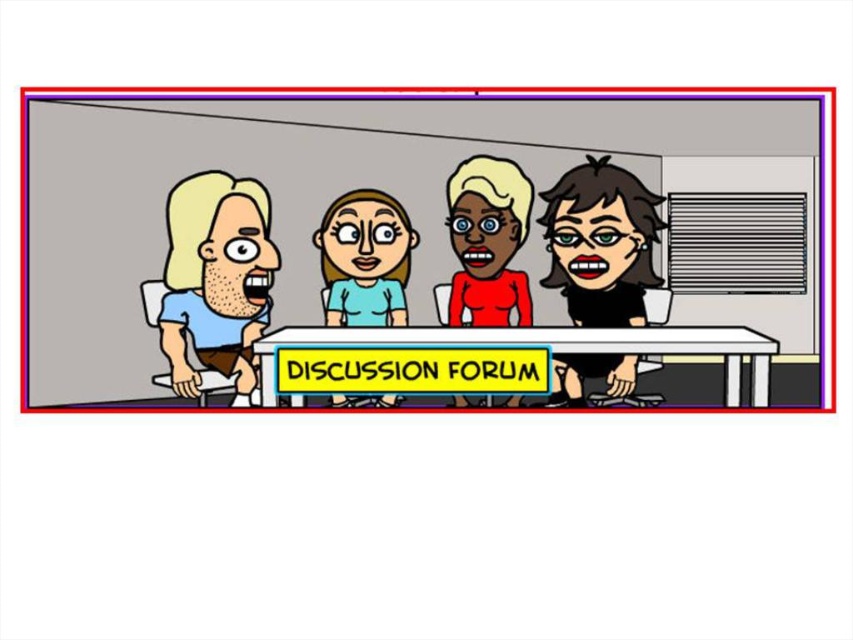
Question: Can you confirm if matte black laptop at left is wider than light blue fabric shirt at center?

Choices:
 (A) yes
 (B) no

Answer: (B)

Question: Which of the following is the farthest from the observer?

Choices:
 (A) smooth red dress at center
 (B) matte black hair at center
 (C) matte black laptop at left
 (D) matte blue shirt at left

Answer: (C)

Question: Does matte blue shirt at left appear on the left side of smooth red dress at center?

Choices:
 (A) no
 (B) yes

Answer: (B)

Question: Estimate the real-world distances between objects in this image. Which object is closer to the matte black laptop at left?

Choices:
 (A) matte black hair at center
 (B) smooth red dress at center
 (C) light blue fabric shirt at center

Answer: (C)

Question: Which point is closer to the camera taking this photo?

Choices:
 (A) [482, 227]
 (B) [395, 324]
 (C) [683, 250]

Answer: (B)

Question: Does matte black laptop at left have a larger size compared to smooth red dress at center?

Choices:
 (A) yes
 (B) no

Answer: (B)